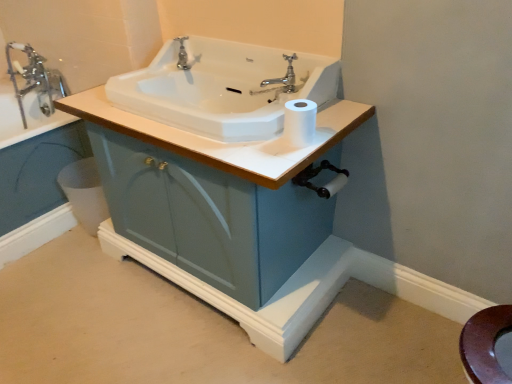
Where is `free spot to the left of matte blue cabinet at center`? free spot to the left of matte blue cabinet at center is located at coordinates (74, 293).